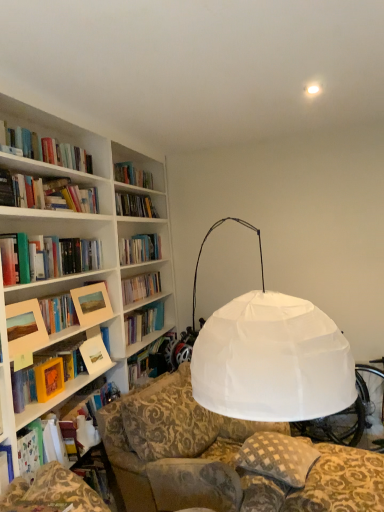
The width and height of the screenshot is (384, 512). Describe the element at coordinates (25, 328) in the screenshot. I see `matte wooden picture frame at left, arranged as the second picture frame when viewed from the back` at that location.

How much space does matte wooden picture frame at left, placed as the 1th picture frame when sorted from left to right, occupy vertically?

10.39 inches.

This screenshot has width=384, height=512. Describe the element at coordinates (95, 355) in the screenshot. I see `matte white book at left, marked as the 1th paperback book in a back-to-front arrangement` at that location.

This screenshot has height=512, width=384. Describe the element at coordinates (278, 457) in the screenshot. I see `checkered fabric pillow at lower center` at that location.

This screenshot has width=384, height=512. What do you see at coordinates (92, 304) in the screenshot?
I see `matte wooden picture frame at upper left, the 2th picture frame viewed from the front` at bounding box center [92, 304].

Locate an element on the screen. The width and height of the screenshot is (384, 512). matte wooden picture frame at upper left, arranged as the first picture frame when viewed from the back is located at coordinates (92, 304).

You are a GUI agent. You are given a task and a screenshot of the screen. Output one action in this format:
    pyautogui.click(x=<x>, y=<y>)
    Task: Click on the yellow matte paper at left, the 2th paperback book when ordered from back to front
    
    Given the screenshot: What is the action you would take?
    pyautogui.click(x=49, y=379)

Is matte wooden picture frame at left, placed as the 1th picture frame when sorted from left to right, not within matte white book at left, placed as the second paperback book when sorted from front to back?

Yes.

What's the angular difference between matte wooden picture frame at left, the second picture frame from the right, and matte white book at left, marked as the 1th paperback book in a back-to-front arrangement,'s facing directions?

4.96 degrees.

From a real-world perspective, which is physically above, matte wooden picture frame at left, the second picture frame from the right, or matte white book at left, which ranks as the 2th paperback book in left-to-right order?

matte wooden picture frame at left, the second picture frame from the right, is physically above.

Which is more to the left, matte wooden picture frame at left, placed as the 1th picture frame when sorted from left to right, or matte white book at left, marked as the 1th paperback book in a back-to-front arrangement?

Positioned to the left is matte wooden picture frame at left, placed as the 1th picture frame when sorted from left to right.

Which is in front, checkered fabric pillow at lower center or matte wooden picture frame at left, the second picture frame from the right?

matte wooden picture frame at left, the second picture frame from the right, is closer to the camera.

Is checkered fabric pillow at lower center inside or outside of matte wooden picture frame at left, the second picture frame from the right?

checkered fabric pillow at lower center is spatially situated outside matte wooden picture frame at left, the second picture frame from the right.

Considering the points (280, 478) and (21, 315), which point is behind, point (280, 478) or point (21, 315)?

The point (21, 315) is more distant.

Considering the relative sizes of checkered fabric pillow at lower center and matte wooden picture frame at left, the second picture frame from the right, in the image provided, is checkered fabric pillow at lower center taller than matte wooden picture frame at left, the second picture frame from the right,?

Incorrect, the height of checkered fabric pillow at lower center is not larger of that of matte wooden picture frame at left, the second picture frame from the right.

How distant is matte white book at left, marked as the 1th paperback book in a back-to-front arrangement, from yellow matte paper at left, the first paperback book in the left-to-right sequence?

13.63 inches.

Image resolution: width=384 pixels, height=512 pixels. In order to click on paperback book behind the yellow matte paper at left, the 2th paperback book when ordered from back to front in this screenshot , I will do `click(95, 355)`.

From the picture: From a real-world perspective, relative to yellow matte paper at left, arranged as the 1th paperback book when viewed from the front, is matte white book at left, which ranks as the 2th paperback book in left-to-right order, vertically above or below?

Clearly, from a real-world perspective, matte white book at left, which ranks as the 2th paperback book in left-to-right order, is below yellow matte paper at left, arranged as the 1th paperback book when viewed from the front.

Between matte white book at left, marked as the 1th paperback book in a back-to-front arrangement, and yellow matte paper at left, the 2th paperback book when ordered from back to front, which one has smaller width?

Thinner between the two is yellow matte paper at left, the 2th paperback book when ordered from back to front.

Are matte wooden picture frame at upper left, arranged as the first picture frame when viewed from the back, and checkered fabric pillow at lower center making contact?

matte wooden picture frame at upper left, arranged as the first picture frame when viewed from the back, is not next to checkered fabric pillow at lower center, and they're not touching.

Based on the photo, in terms of height, does matte wooden picture frame at upper left, arranged as the first picture frame when viewed from the back, look taller or shorter compared to checkered fabric pillow at lower center?

In the image, matte wooden picture frame at upper left, arranged as the first picture frame when viewed from the back, appears to be taller than checkered fabric pillow at lower center.

Between point (107, 316) and point (272, 475), which one is positioned in front?

The point (272, 475) is in front.

Is yellow matte paper at left, arranged as the 1th paperback book when viewed from the front, not inside matte wooden picture frame at left, arranged as the second picture frame when viewed from the back?

Yes, yellow matte paper at left, arranged as the 1th paperback book when viewed from the front, is located beyond the bounds of matte wooden picture frame at left, arranged as the second picture frame when viewed from the back.

Is yellow matte paper at left, arranged as the 1th paperback book when viewed from the front, turned away from matte wooden picture frame at left, arranged as the 1th picture frame when viewed from the front?

No, matte wooden picture frame at left, arranged as the 1th picture frame when viewed from the front, is not at the back of yellow matte paper at left, arranged as the 1th paperback book when viewed from the front.

Is yellow matte paper at left, the first paperback book in the left-to-right sequence, far from matte wooden picture frame at left, arranged as the 1th picture frame when viewed from the front?

No, yellow matte paper at left, the first paperback book in the left-to-right sequence, is not far away from matte wooden picture frame at left, arranged as the 1th picture frame when viewed from the front.

From a real-world perspective, which picture frame is the 1st one above the yellow matte paper at left, the 2th paperback book when ordered from back to front? Please provide its 2D coordinates.

[(25, 328)]

What's the angular difference between matte wooden picture frame at left, the second picture frame from the right, and checkered fabric pillow at lower center's facing directions?

The angle between the facing direction of matte wooden picture frame at left, the second picture frame from the right, and the facing direction of checkered fabric pillow at lower center is 17.3 degrees.

Considering the sizes of objects matte wooden picture frame at left, arranged as the 1th picture frame when viewed from the front, and checkered fabric pillow at lower center in the image provided, who is smaller, matte wooden picture frame at left, arranged as the 1th picture frame when viewed from the front, or checkered fabric pillow at lower center?

With smaller size is matte wooden picture frame at left, arranged as the 1th picture frame when viewed from the front.

Can you confirm if matte wooden picture frame at left, the second picture frame from the right, is taller than checkered fabric pillow at lower center?

Yes, matte wooden picture frame at left, the second picture frame from the right, is taller than checkered fabric pillow at lower center.

Looking at this image, is there a large distance between matte wooden picture frame at left, arranged as the second picture frame when viewed from the back, and checkered fabric pillow at lower center?

Yes, matte wooden picture frame at left, arranged as the second picture frame when viewed from the back, is far from checkered fabric pillow at lower center.

Considering the relative sizes of matte wooden picture frame at left, arranged as the 1th picture frame when viewed from the front, and yellow matte paper at left, marked as the second paperback book in a right-to-left arrangement, in the image provided, is matte wooden picture frame at left, arranged as the 1th picture frame when viewed from the front, bigger than yellow matte paper at left, marked as the second paperback book in a right-to-left arrangement,?

Indeed, matte wooden picture frame at left, arranged as the 1th picture frame when viewed from the front, has a larger size compared to yellow matte paper at left, marked as the second paperback book in a right-to-left arrangement.

Consider the image. Which of these two, matte wooden picture frame at left, placed as the 1th picture frame when sorted from left to right, or yellow matte paper at left, marked as the second paperback book in a right-to-left arrangement, is thinner?

Thinner between the two is yellow matte paper at left, marked as the second paperback book in a right-to-left arrangement.

How many degrees apart are the facing directions of matte wooden picture frame at left, placed as the 1th picture frame when sorted from left to right, and yellow matte paper at left, marked as the second paperback book in a right-to-left arrangement?

4.61 degrees separate the facing orientations of matte wooden picture frame at left, placed as the 1th picture frame when sorted from left to right, and yellow matte paper at left, marked as the second paperback book in a right-to-left arrangement.

Can you confirm if matte wooden picture frame at left, arranged as the 1th picture frame when viewed from the front, is positioned to the right of yellow matte paper at left, the 2th paperback book when ordered from back to front?

No.

The width and height of the screenshot is (384, 512). Identify the location of picture frame that is the 1st one when counting upward from the matte white book at left, placed as the second paperback book when sorted from front to back (from the image's perspective). (25, 328).

Image resolution: width=384 pixels, height=512 pixels. I want to click on the 2nd picture frame counting from the left of the checkered fabric pillow at lower center, so click(25, 328).

When comparing their distances from yellow matte paper at left, the first paperback book in the left-to-right sequence, does checkered fabric pillow at lower center or matte wooden picture frame at upper left, positioned as the 2th picture frame in left-to-right order, seem closer?

Among the two, matte wooden picture frame at upper left, positioned as the 2th picture frame in left-to-right order, is located nearer to yellow matte paper at left, the first paperback book in the left-to-right sequence.

Based on their spatial positions, is matte wooden picture frame at left, placed as the 1th picture frame when sorted from left to right, or matte white book at left, placed as the second paperback book when sorted from front to back, closer to checkered fabric pillow at lower center?

Based on the image, matte white book at left, placed as the second paperback book when sorted from front to back, appears to be nearer to checkered fabric pillow at lower center.

Considering their positions, is checkered fabric pillow at lower center positioned further to matte white book at left, placed as the second paperback book when sorted from front to back, than yellow matte paper at left, the 2th paperback book when ordered from back to front?

Among the two, checkered fabric pillow at lower center is located further to matte white book at left, placed as the second paperback book when sorted from front to back.

From the image, which object appears to be farther from matte wooden picture frame at left, placed as the 1th picture frame when sorted from left to right, matte wooden picture frame at upper left, the 2th picture frame viewed from the front, or yellow matte paper at left, marked as the second paperback book in a right-to-left arrangement?

The object further to matte wooden picture frame at left, placed as the 1th picture frame when sorted from left to right, is matte wooden picture frame at upper left, the 2th picture frame viewed from the front.

When comparing their distances from matte wooden picture frame at left, placed as the 1th picture frame when sorted from left to right, does matte white book at left, which ranks as the 2th paperback book in left-to-right order, or yellow matte paper at left, the first paperback book in the left-to-right sequence, seem further?

matte white book at left, which ranks as the 2th paperback book in left-to-right order.

Based on their spatial positions, is matte wooden picture frame at left, the second picture frame from the right, or checkered fabric pillow at lower center further from matte wooden picture frame at upper left, positioned as the 2th picture frame in left-to-right order?

Among the two, checkered fabric pillow at lower center is located further to matte wooden picture frame at upper left, positioned as the 2th picture frame in left-to-right order.

When comparing their distances from matte wooden picture frame at left, the second picture frame from the right, does checkered fabric pillow at lower center or yellow matte paper at left, marked as the second paperback book in a right-to-left arrangement, seem further?

The object further to matte wooden picture frame at left, the second picture frame from the right, is checkered fabric pillow at lower center.

Looking at the image, which one is located closer to matte white book at left, which ranks as the 2th paperback book in left-to-right order, matte wooden picture frame at upper left, positioned as the 2th picture frame in left-to-right order, or matte wooden picture frame at left, placed as the 1th picture frame when sorted from left to right?

Based on the image, matte wooden picture frame at upper left, positioned as the 2th picture frame in left-to-right order, appears to be nearer to matte white book at left, which ranks as the 2th paperback book in left-to-right order.

Find the location of `picture frame between yellow matte paper at left, arranged as the 1th paperback book when viewed from the front, and checkered fabric pillow at lower center, in the horizontal direction`. picture frame between yellow matte paper at left, arranged as the 1th paperback book when viewed from the front, and checkered fabric pillow at lower center, in the horizontal direction is located at coordinates (92, 304).

Where is `picture frame between matte wooden picture frame at left, arranged as the second picture frame when viewed from the back, and checkered fabric pillow at lower center, in the horizontal direction`? The width and height of the screenshot is (384, 512). picture frame between matte wooden picture frame at left, arranged as the second picture frame when viewed from the back, and checkered fabric pillow at lower center, in the horizontal direction is located at coordinates (92, 304).

The image size is (384, 512). What are the coordinates of `paperback book between matte wooden picture frame at left, the second picture frame from the right, and matte white book at left, which is counted as the 1th paperback book, starting from the right, in the front-back direction` in the screenshot? It's located at (49, 379).

Find the location of a particular element. Image resolution: width=384 pixels, height=512 pixels. picture frame between matte wooden picture frame at left, arranged as the second picture frame when viewed from the back, and matte white book at left, which is counted as the 1th paperback book, starting from the right, from front to back is located at coordinates (92, 304).